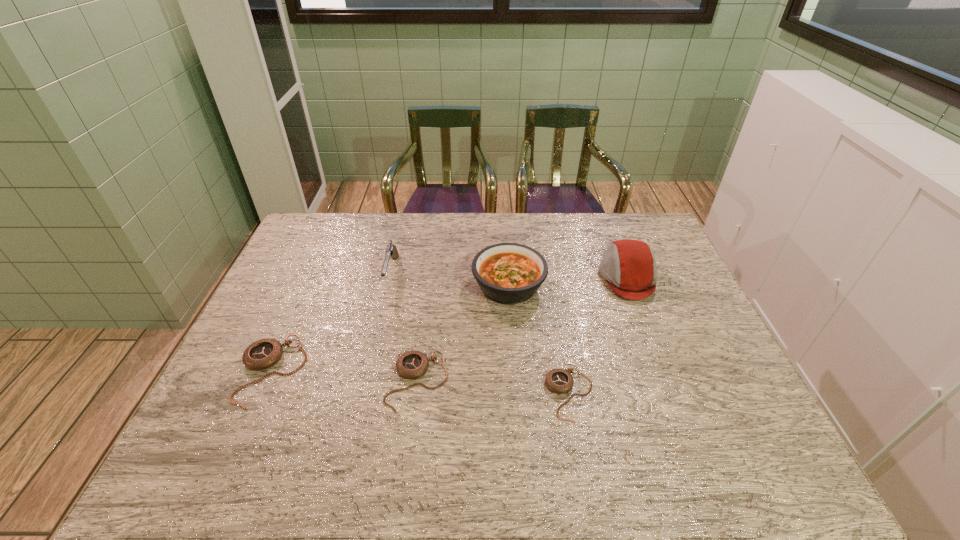
The height and width of the screenshot is (540, 960). Find the location of `free space between the rightmost object and the second pocket watch from right to left`. free space between the rightmost object and the second pocket watch from right to left is located at coordinates (522, 329).

Where is `vacant area that lies between the gun and the stew`? vacant area that lies between the gun and the stew is located at coordinates (450, 279).

Where is `free spot between the cap and the leftmost pocket watch`? This screenshot has height=540, width=960. free spot between the cap and the leftmost pocket watch is located at coordinates (449, 324).

Find the location of `free space between the shortest pocket watch and the leftmost object`. free space between the shortest pocket watch and the leftmost object is located at coordinates (420, 382).

The width and height of the screenshot is (960, 540). I want to click on free space between the rightmost pocket watch and the rightmost object, so click(x=599, y=335).

Where is `object that stands as the second closest to the third object from left to right`? This screenshot has height=540, width=960. object that stands as the second closest to the third object from left to right is located at coordinates (262, 354).

You are a GUI agent. You are given a task and a screenshot of the screen. Output one action in this format:
    pyautogui.click(x=<x>, y=<y>)
    Task: Click on the third closest object to the leftmost object
    
    Given the screenshot: What is the action you would take?
    pyautogui.click(x=508, y=273)

Identify which pocket watch is located as the nearest to the rightmost object. Please provide its 2D coordinates. Your answer should be formatted as a tuple, i.e. [(x, y)], where the tuple contains the x and y coordinates of a point satisfying the conditions above.

[(559, 381)]

You are a GUI agent. You are given a task and a screenshot of the screen. Output one action in this format:
    pyautogui.click(x=<x>, y=<y>)
    Task: Click on the pocket watch that stands as the second closest to the leftmost object
    This screenshot has width=960, height=540.
    Given the screenshot: What is the action you would take?
    click(559, 381)

Identify the location of free space that satisfies the following two spatial constraints: 1. on the front side of the stew; 2. on the left side of the shortest object. (516, 393).